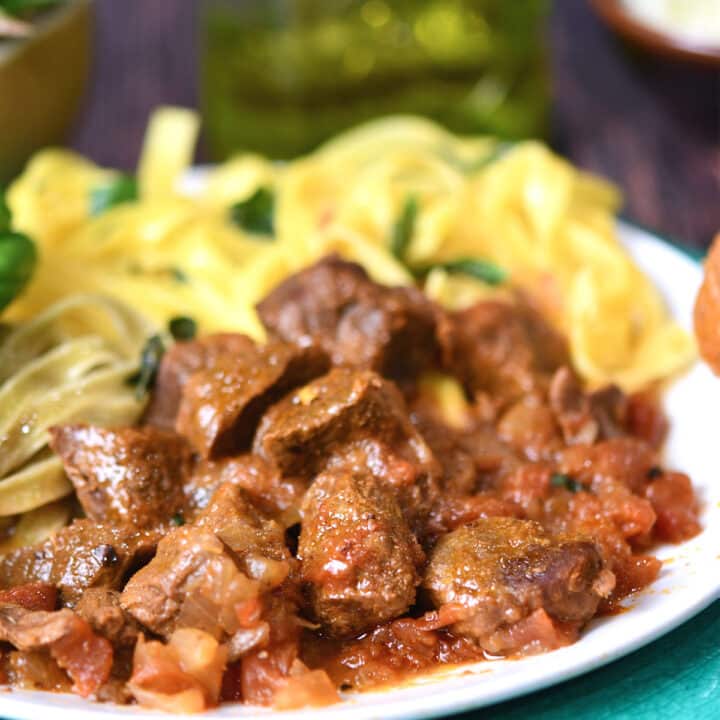
What are the coordinates of `white plate` in the screenshot? It's located at (540, 670).